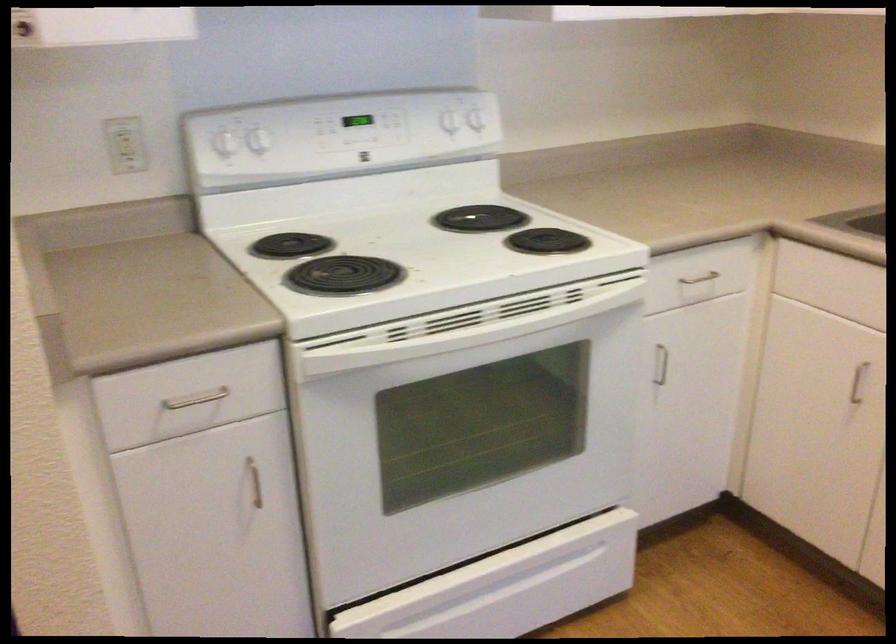
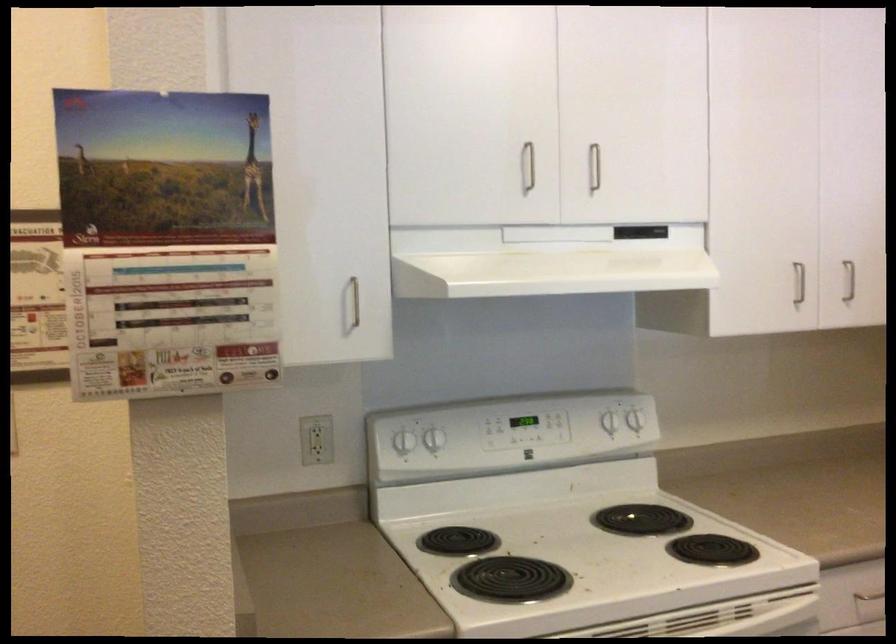
In the second image, find the point that corresponds to point 225,134 in the first image.

(400, 433)